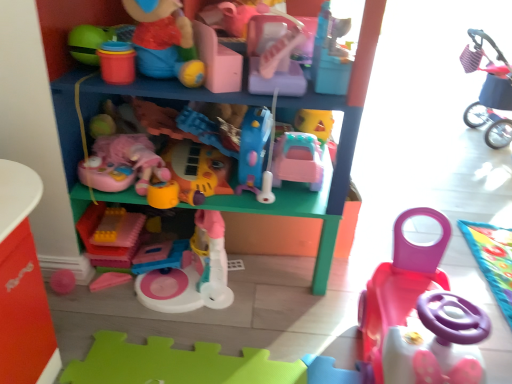
Where is `unoccupied region to the right of pink plastic toy at center, the 7th toy in the right-to-left sequence`? unoccupied region to the right of pink plastic toy at center, the 7th toy in the right-to-left sequence is located at coordinates (275, 299).